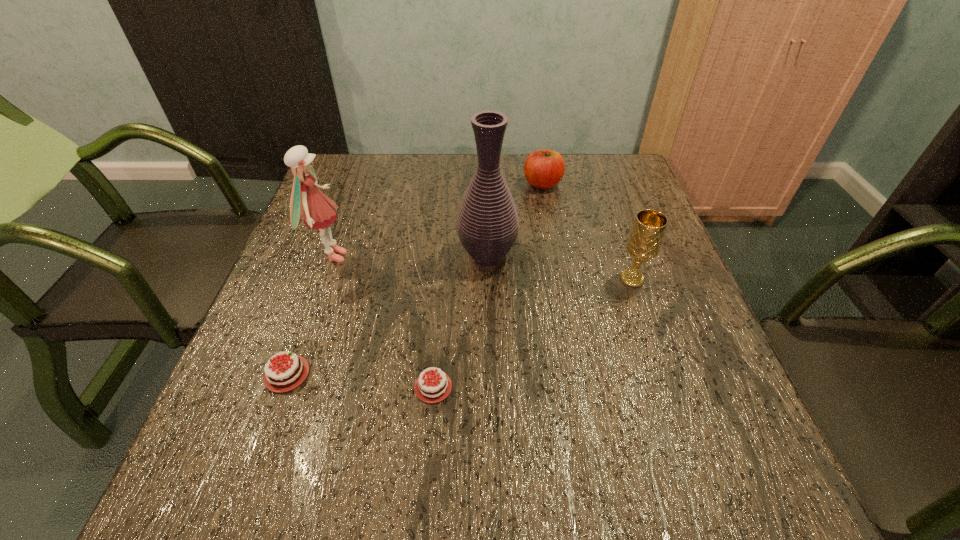
At what (x,y) coordinates should I click in order to perform the action: click on the left chocolate cake. Please return your answer as a coordinate pair (x, y). The image size is (960, 540). Looking at the image, I should click on (282, 376).

You are a GUI agent. You are given a task and a screenshot of the screen. Output one action in this format:
    pyautogui.click(x=<x>, y=<y>)
    Task: Click on the fifth tallest object
    This screenshot has width=960, height=540.
    Given the screenshot: What is the action you would take?
    pyautogui.click(x=282, y=376)

Where is `the shorter chocolate cake`? The image size is (960, 540). the shorter chocolate cake is located at coordinates (432, 388).

I want to click on the right chocolate cake, so click(x=432, y=388).

In order to click on the third shortest object in this screenshot , I will do `click(543, 169)`.

You are a GUI agent. You are given a task and a screenshot of the screen. Output one action in this format:
    pyautogui.click(x=<x>, y=<y>)
    Task: Click on the fifth object from left to right
    This screenshot has width=960, height=540.
    Given the screenshot: What is the action you would take?
    pyautogui.click(x=543, y=169)

Where is `chalice`? chalice is located at coordinates tap(644, 242).

Image resolution: width=960 pixels, height=540 pixels. Find the location of `the rightmost object`. the rightmost object is located at coordinates (644, 242).

Locate an element on the screen. This screenshot has height=540, width=960. vase is located at coordinates (487, 224).

At what (x,y) coordinates should I click in order to perform the action: click on doll. Please return your answer as a coordinate pair (x, y). Looking at the image, I should click on (316, 209).